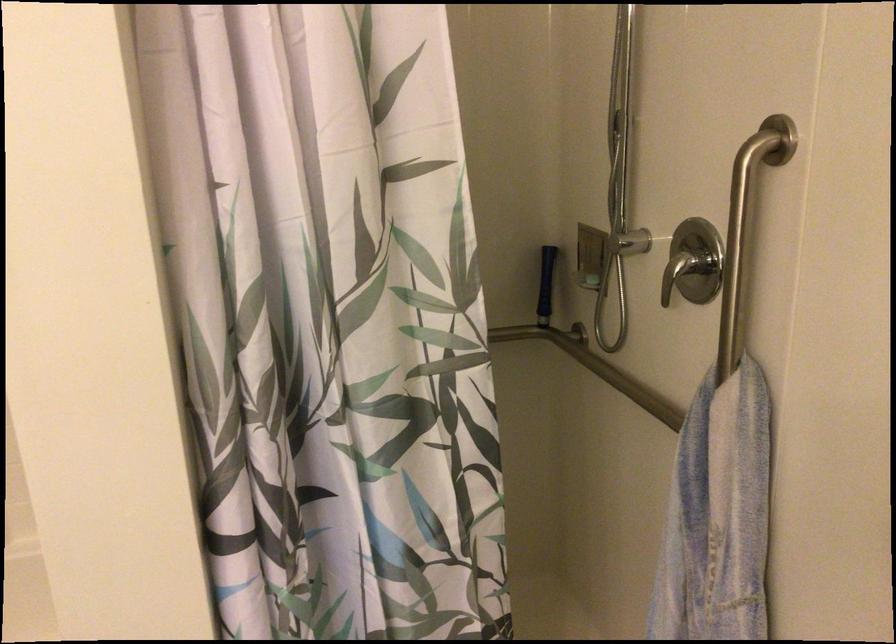
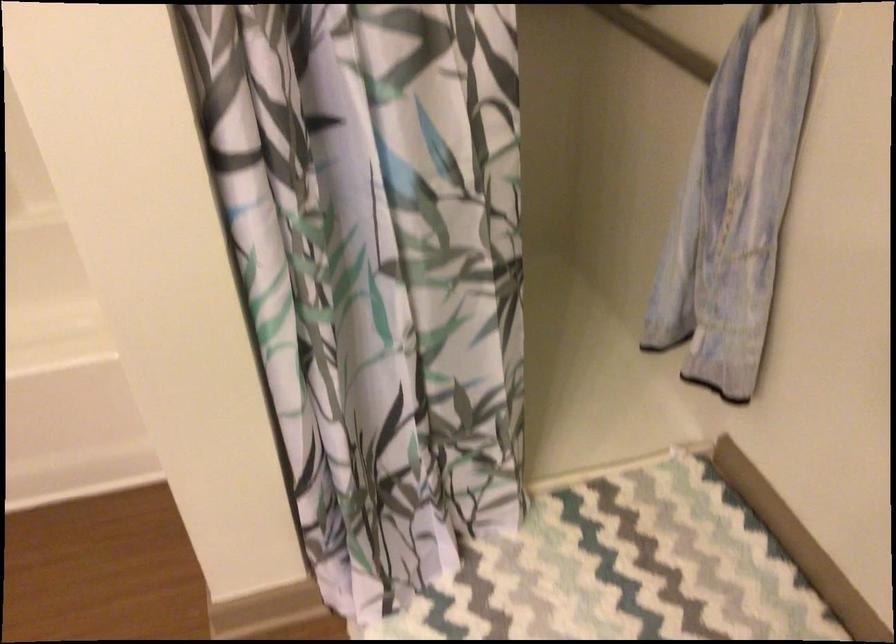
Question: What movement of the cameraman would produce the second image?

Choices:
 (A) Left
 (B) Right
 (C) Forward
 (D) Backward

Answer: (C)